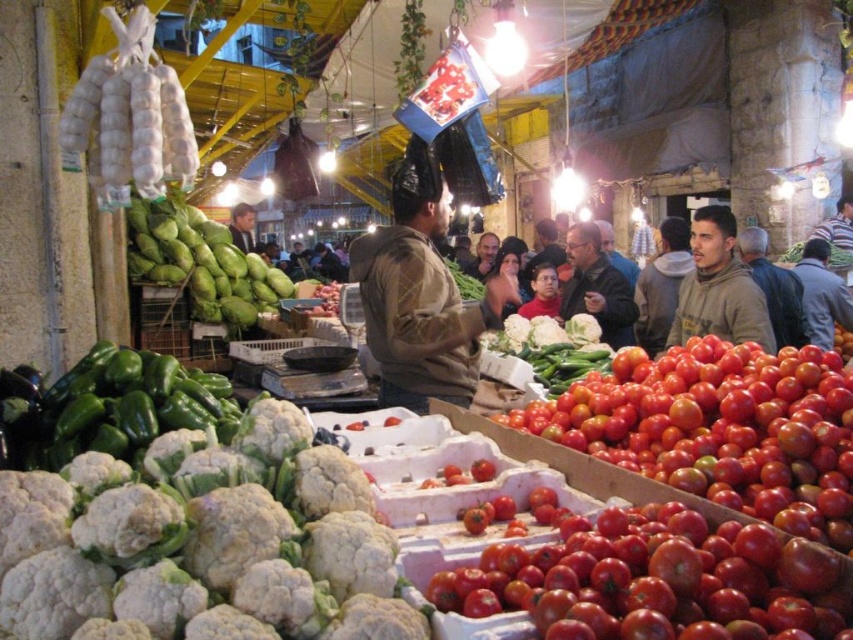
Does brown textured jacket at center have a lesser width compared to matte brown hoodie at right?

Yes, brown textured jacket at center is thinner than matte brown hoodie at right.

Which is in front, point (447, 282) or point (828, 256)?

Positioned in front is point (447, 282).

Who is more forward, (409, 256) or (810, 272)?

Positioned in front is point (409, 256).

Locate an element on the screen. This screenshot has width=853, height=640. brown textured jacket at center is located at coordinates (421, 294).

Is red matte tomatoes at center below brown textured jacket at center?

Yes, red matte tomatoes at center is below brown textured jacket at center.

Between red matte tomatoes at center and brown textured jacket at center, which one is positioned lower?

red matte tomatoes at center is lower down.

The height and width of the screenshot is (640, 853). Find the location of `red matte tomatoes at center`. red matte tomatoes at center is located at coordinates (720, 428).

At what (x,y) coordinates should I click in order to perform the action: click on red matte tomatoes at center. Please return your answer as a coordinate pair (x, y). This screenshot has height=640, width=853. Looking at the image, I should click on (720, 428).

Does smooth green cucumber at center come behind matte brown hoodie at right?

No, smooth green cucumber at center is in front of matte brown hoodie at right.

Is smooth green cucumber at center above matte brown hoodie at right?

No, smooth green cucumber at center is not above matte brown hoodie at right.

Between point (509, 346) and point (838, 291), which one is positioned in front?

Point (509, 346) is in front.

Image resolution: width=853 pixels, height=640 pixels. I want to click on smooth green cucumber at center, so 546,349.